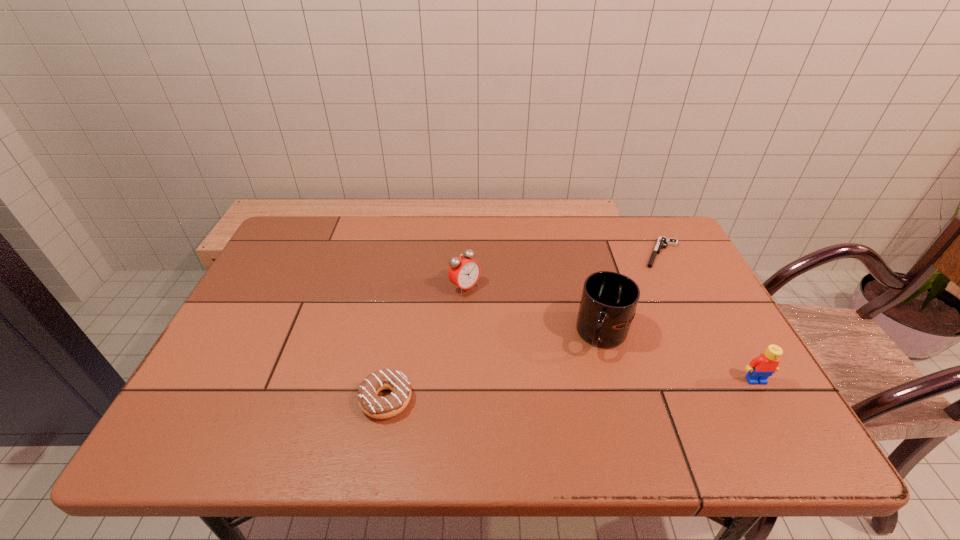
Locate an element on the screen. vacant space on the desktop that is between the doughnut and the Lego and is positioned on the front-facing side of the alarm clock is located at coordinates [598, 388].

The image size is (960, 540). Find the location of `vacant spot on the desktop that is between the second shortest object and the Lego and is positioned with the handle on the side of the mug`. vacant spot on the desktop that is between the second shortest object and the Lego and is positioned with the handle on the side of the mug is located at coordinates (557, 390).

The image size is (960, 540). I want to click on vacant space on the desktop that is between the doughnut and the Lego and is positioned on the front-facing side of the pistol, so click(615, 388).